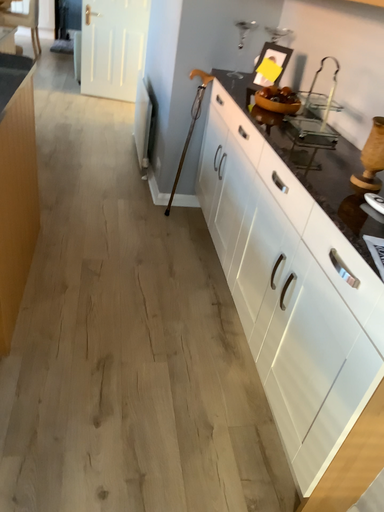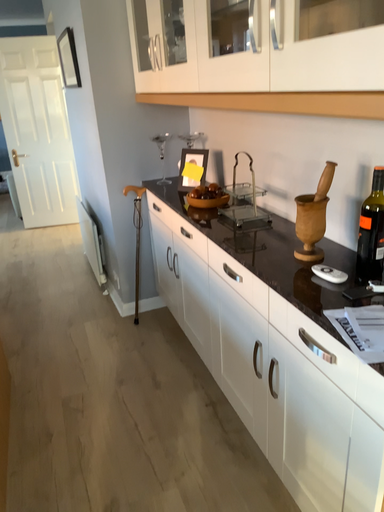
Question: Which way did the camera rotate in the video?

Choices:
 (A) rotated downward
 (B) rotated upward

Answer: (B)